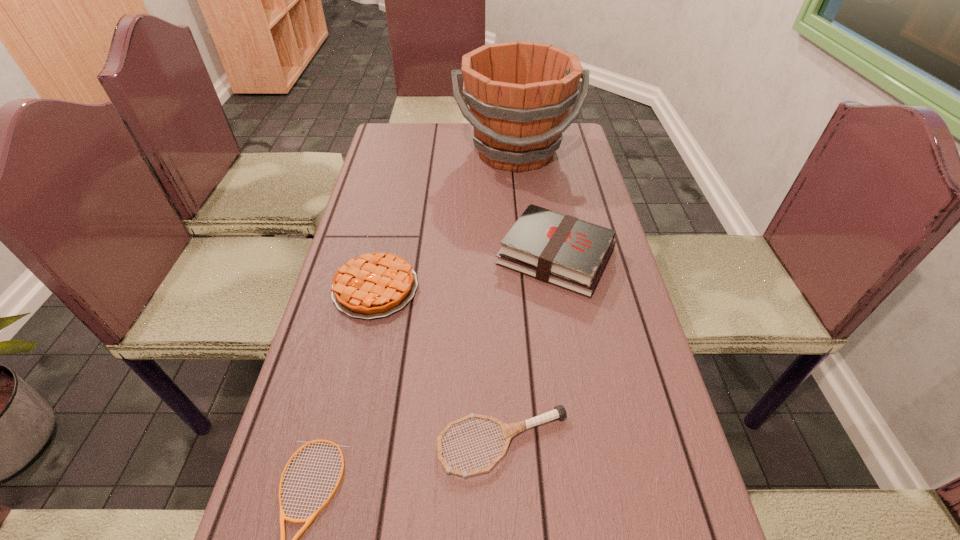
Where is `object situated at the far edge`? The width and height of the screenshot is (960, 540). object situated at the far edge is located at coordinates [519, 93].

The image size is (960, 540). Find the location of `object located in the left edge section of the desktop`. object located in the left edge section of the desktop is located at coordinates (374, 285).

Image resolution: width=960 pixels, height=540 pixels. I want to click on bucket at the right edge, so click(x=519, y=93).

The height and width of the screenshot is (540, 960). Identify the location of hardback book that is at the right edge. (558, 249).

At what (x,y) coordinates should I click in order to perform the action: click on object that is at the far right corner. Please return your answer as a coordinate pair (x, y). The height and width of the screenshot is (540, 960). Looking at the image, I should click on (519, 93).

Locate an element on the screen. Image resolution: width=960 pixels, height=540 pixels. free space at the left edge of the desktop is located at coordinates (338, 501).

Identify the location of vacant space at the right edge of the desktop. (684, 491).

At what (x,y) coordinates should I click in order to perform the action: click on free space at the far right corner of the desktop. Please return your answer as a coordinate pair (x, y). Looking at the image, I should click on (577, 123).

You are a GUI agent. You are given a task and a screenshot of the screen. Output one action in this format:
    pyautogui.click(x=<x>, y=<y>)
    Task: Click on the vacant space in between the hardback book and the farthest object
    This screenshot has width=960, height=540.
    Given the screenshot: What is the action you would take?
    pyautogui.click(x=536, y=204)

At what (x,y) coordinates should I click in order to perform the action: click on free space between the bucket and the taller tennis racket. Please return your answer as a coordinate pair (x, y). The width and height of the screenshot is (960, 540). Looking at the image, I should click on (510, 298).